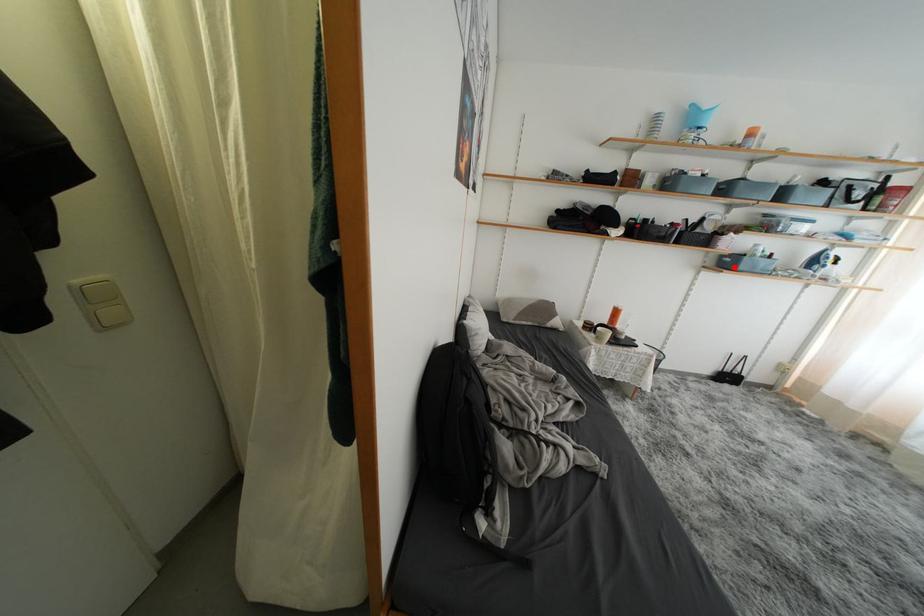
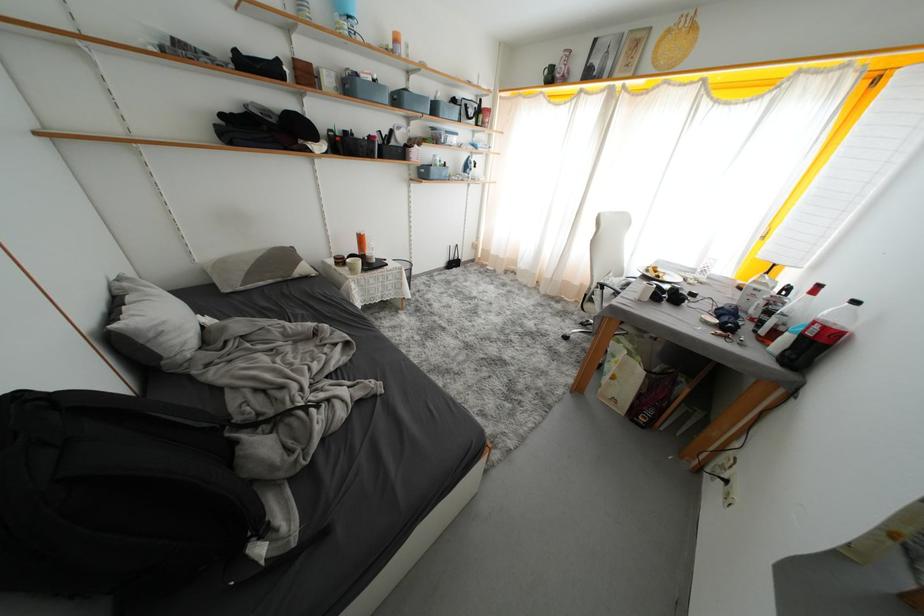
The point at the highlighted location is marked in the first image. Where is the corresponding point in the second image?

(431, 177)